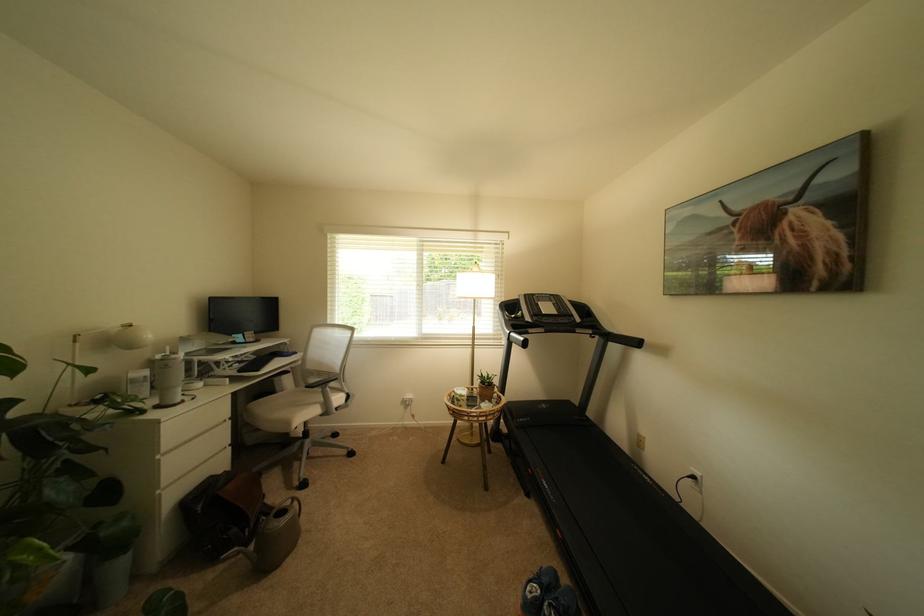
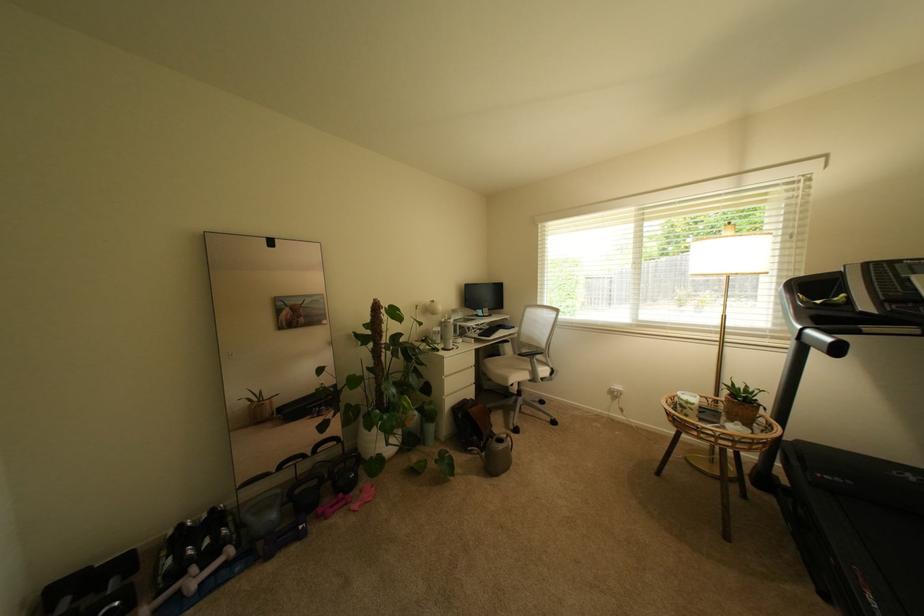
In the second image, find the point that corresponds to (297,353) in the first image.

(517, 328)